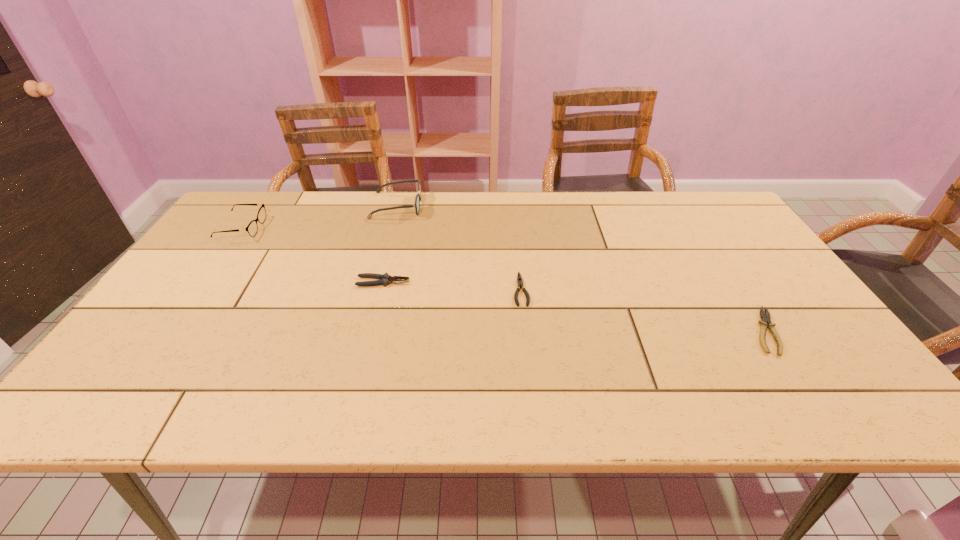
The image size is (960, 540). Identify the location of vacant space at the right edge of the desktop. 787,310.

Where is `unoccupied area between the left spectacles and the taller spectacles`? The height and width of the screenshot is (540, 960). unoccupied area between the left spectacles and the taller spectacles is located at coordinates (320, 217).

This screenshot has width=960, height=540. In order to click on vacant space that is in between the third tallest object and the right spectacles in this screenshot , I will do `click(390, 244)`.

The height and width of the screenshot is (540, 960). What are the coordinates of `free space between the second pliers from left to right and the third shortest object` in the screenshot? It's located at (452, 286).

The width and height of the screenshot is (960, 540). In order to click on vacant area between the tallest pliers and the fourth shortest object in this screenshot , I will do `click(312, 255)`.

Where is `free space between the taller spectacles and the third shortest object`? Image resolution: width=960 pixels, height=540 pixels. free space between the taller spectacles and the third shortest object is located at coordinates (390, 244).

This screenshot has height=540, width=960. I want to click on free point between the leftmost pliers and the nearest object, so click(x=574, y=307).

Where is `free spot between the leftmost object and the rightmost pliers`? Image resolution: width=960 pixels, height=540 pixels. free spot between the leftmost object and the rightmost pliers is located at coordinates (504, 280).

This screenshot has width=960, height=540. Identify the location of free space between the leftmost pliers and the nearest pliers. (574, 307).

You are a GUI agent. You are given a task and a screenshot of the screen. Output one action in this format:
    pyautogui.click(x=<x>, y=<y>)
    Task: Click on the free spot between the right spectacles and the tallest pliers
    
    Given the screenshot: What is the action you would take?
    coord(390,244)